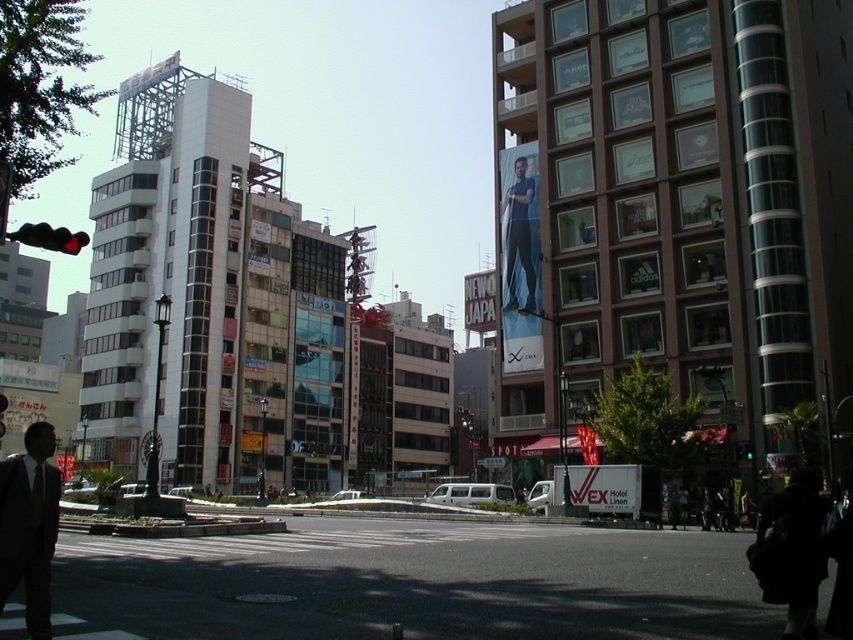
How much distance is there between matte blue jeans at center and white fabric sign at center?

matte blue jeans at center and white fabric sign at center are 11.28 meters apart.

Between matte blue jeans at center and white fabric sign at center, which one is positioned lower?

white fabric sign at center is lower down.

Between point (503, 179) and point (465, 282), which one is positioned in front?

Point (503, 179) is in front.

The width and height of the screenshot is (853, 640). I want to click on matte blue jeans at center, so click(519, 259).

Can you confirm if matte black suit at lower left is thinner than red glass traffic light at upper left?

Yes, matte black suit at lower left is thinner than red glass traffic light at upper left.

Does point (41, 545) come farther from viewer compared to point (39, 246)?

That is False.

Is point (32, 464) less distant than point (47, 228)?

Yes, point (32, 464) is in front of point (47, 228).

This screenshot has width=853, height=640. Find the location of `matte black suit at lower left`. matte black suit at lower left is located at coordinates (28, 525).

Is matte black suit at lower left to the left of green glass traffic light at lower right from the viewer's perspective?

Correct, you'll find matte black suit at lower left to the left of green glass traffic light at lower right.

Can you confirm if matte black suit at lower left is positioned below green glass traffic light at lower right?

Yes, matte black suit at lower left is below green glass traffic light at lower right.

Who is more forward, [24,584] or [746,449]?

Positioned in front is point [24,584].

Where is `matte black suit at lower left`? matte black suit at lower left is located at coordinates (28, 525).